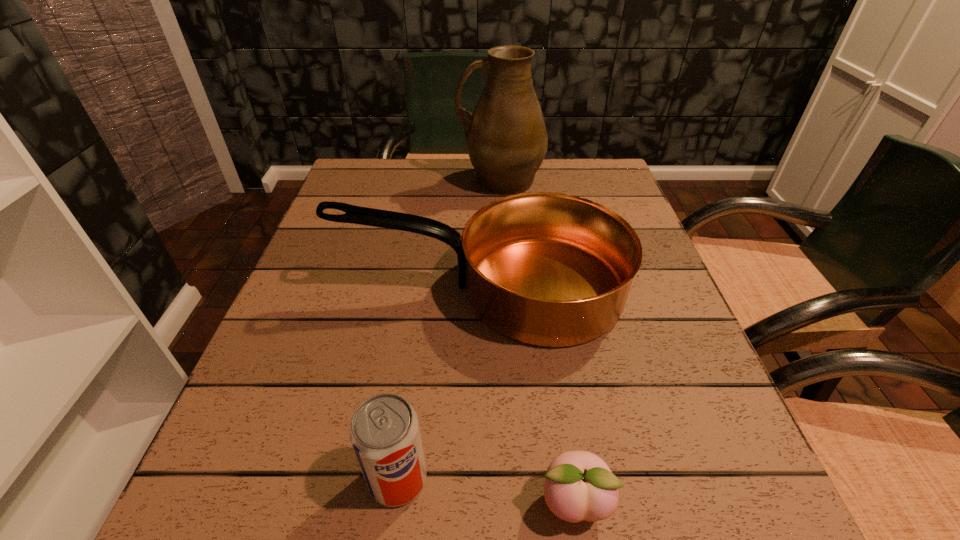
Identify the location of pitcher. This screenshot has height=540, width=960. (506, 138).

This screenshot has width=960, height=540. In order to click on the tallest object in this screenshot , I will do `click(506, 138)`.

Locate an element on the screen. This screenshot has width=960, height=540. the second farthest object is located at coordinates (547, 269).

What are the coordinates of `frying pan` in the screenshot? It's located at (547, 269).

Locate an element on the screen. soda is located at coordinates (385, 435).

The height and width of the screenshot is (540, 960). Identify the location of the shortest object. (579, 485).

Where is `free space located on the handle side of the tallest object`? This screenshot has width=960, height=540. free space located on the handle side of the tallest object is located at coordinates tap(382, 181).

Where is `free region located on the handle side of the tallest object`? This screenshot has width=960, height=540. free region located on the handle side of the tallest object is located at coordinates (400, 181).

Identify the location of vacant space situated on the handle side of the tallest object. This screenshot has height=540, width=960. (339, 181).

You are a GUI agent. You are given a task and a screenshot of the screen. Output one action in this format:
    pyautogui.click(x=<x>, y=<y>)
    Task: Click on the blank space located 0.080m on the handle side of the second tallest object
    Image resolution: width=960 pixels, height=540 pixels.
    Given the screenshot: What is the action you would take?
    pyautogui.click(x=300, y=288)